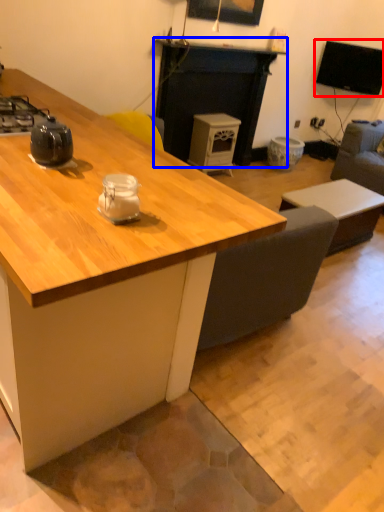
Question: Which object appears farthest to the camera in this image, television (highlighted by a red box) or fireplace (highlighted by a blue box)?

Choices:
 (A) television
 (B) fireplace

Answer: (A)